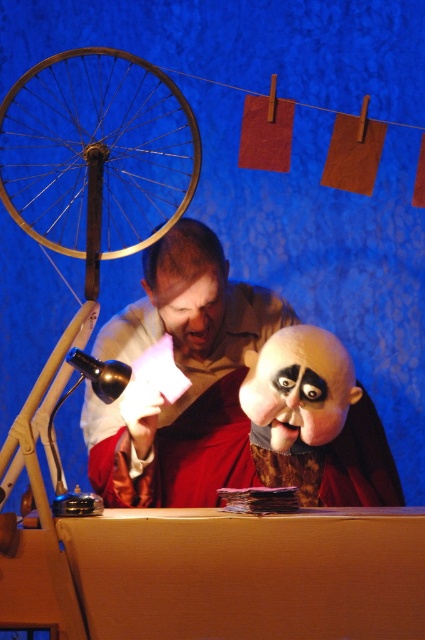
Question: Among these points, which one is farthest from the camera?

Choices:
 (A) (78, 152)
 (B) (223, 320)

Answer: (B)

Question: Is matte white shirt at center thinner than gold metallic bicycle wheel at left?

Choices:
 (A) no
 (B) yes

Answer: (B)

Question: Which of the following is the farthest from the observer?

Choices:
 (A) (180, 294)
 (B) (93, 68)

Answer: (B)

Question: Does matte white shirt at center have a smaller size compared to gold metallic bicycle wheel at left?

Choices:
 (A) no
 (B) yes

Answer: (B)

Question: From the image, what is the correct spatial relationship of matte white shirt at center in relation to gold metallic bicycle wheel at left?

Choices:
 (A) above
 (B) below

Answer: (B)